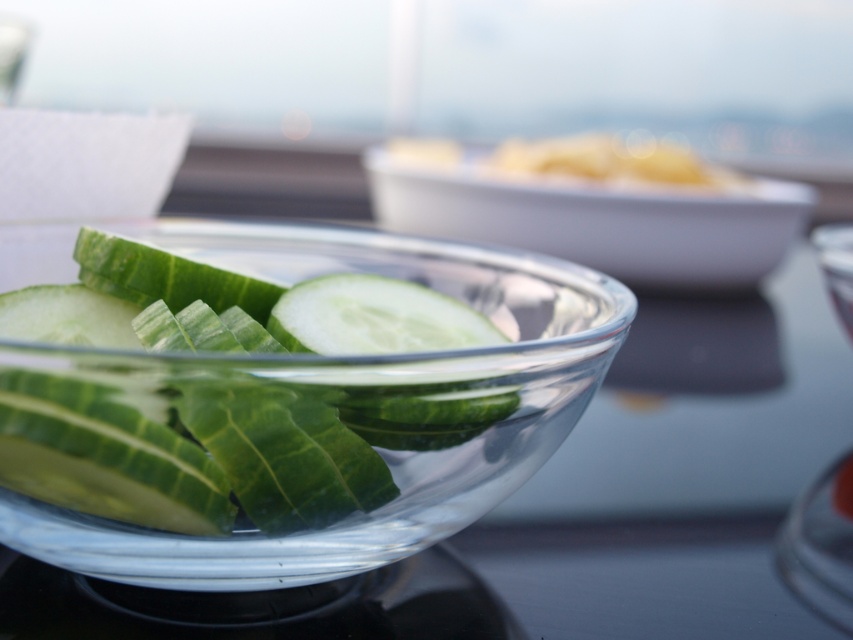
You are setting up a table for a salad bar and have both a transparent glass bowl at center and a clear glass bowl at center. Which bowl should you choose if you need the wider one for holding more salad ingredients?

The clear glass bowl at center has a greater width than the transparent glass bowl at center, so you should choose the clear glass bowl at center for holding more salad ingredients.

You are setting up a buffet table and need to arrange the transparent glass bowl at center and the clear glass bowl at center. According to the image, which one should be placed lower on the table?

The transparent glass bowl at center should be placed lower on the table since it is located below the clear glass bowl at center in the image.